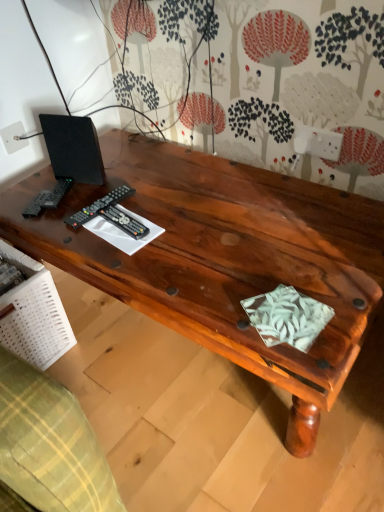
Where is `free spot in front of black plastic remote at left, which appears as the 1th control when viewed from the left`? The image size is (384, 512). free spot in front of black plastic remote at left, which appears as the 1th control when viewed from the left is located at coordinates (106, 249).